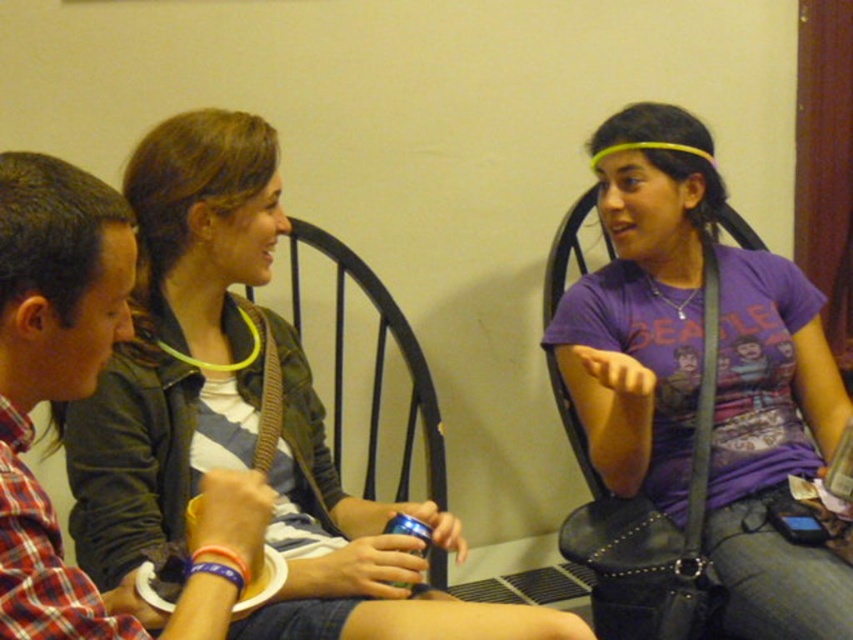
Is point (676, 486) closer to camera compared to point (247, 291)?

Yes, it is.

Between point (825, 390) and point (427, 394), which one is positioned behind?

The point (427, 394) is more distant.

At what (x,y) coordinates should I click in order to perform the action: click on purple matte shirt at center. Please return your answer as a coordinate pair (x, y). This screenshot has height=640, width=853. Looking at the image, I should click on (643, 305).

Image resolution: width=853 pixels, height=640 pixels. What are the coordinates of `purple matte shirt at center` in the screenshot? It's located at (643, 305).